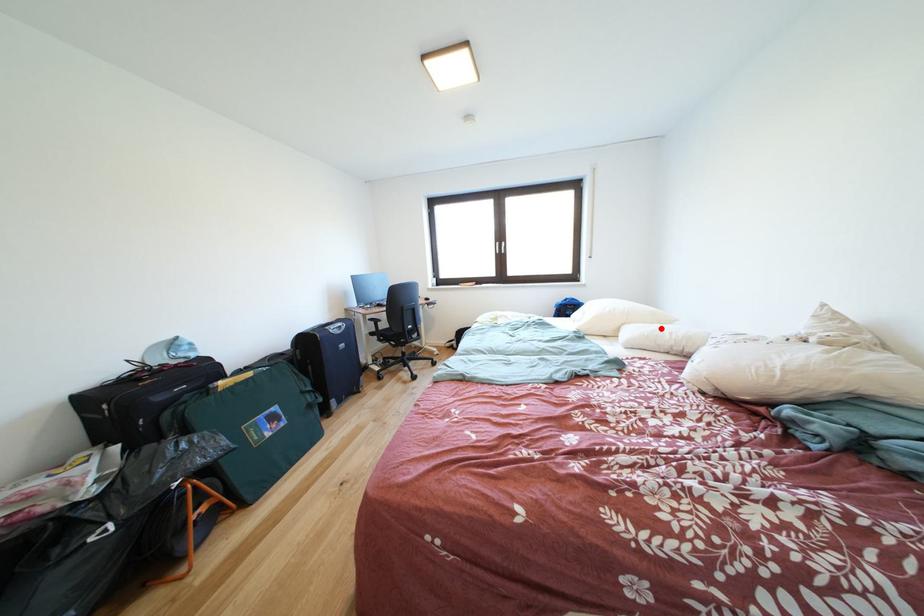
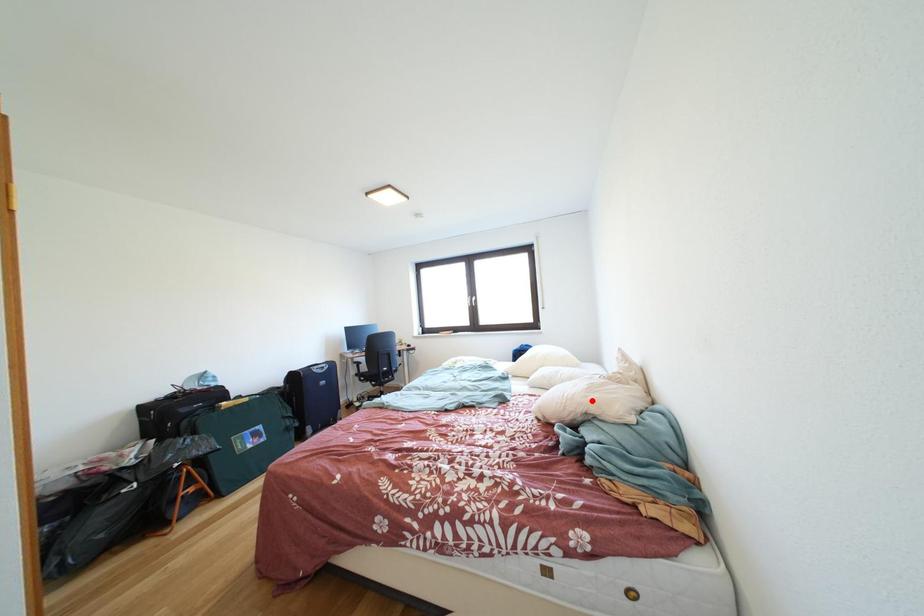
I am providing you with two images of the same scene from different viewpoints. A red point is marked on the first image and another point is marked on the second image. Is the marked point in image1 the same physical position as the marked point in image2?

No